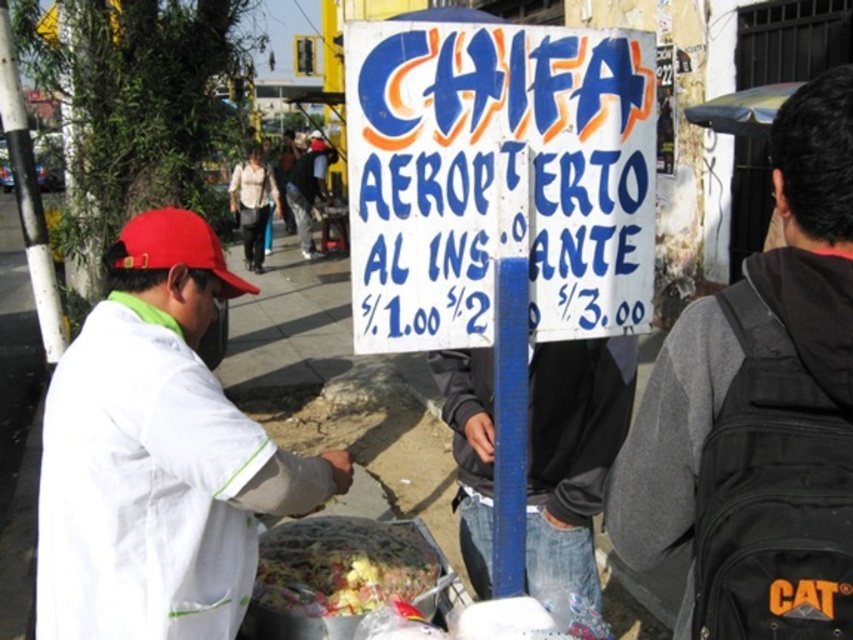
Is white cardboard sign at center wider than shiny plastic container at center?

Correct, the width of white cardboard sign at center exceeds that of shiny plastic container at center.

Where is `white cardboard sign at center`? Image resolution: width=853 pixels, height=640 pixels. white cardboard sign at center is located at coordinates (497, 179).

Is the position of white cardboard sign at center less distant than that of white fabric jacket at left?

No, white cardboard sign at center is further to the viewer.

Does point (381, 352) come farther from viewer compared to point (317, 504)?

That is False.

Does point (614, 221) lie in front of point (51, 618)?

No, it is behind (51, 618).

At what (x,y) coordinates should I click in order to perform the action: click on white cardboard sign at center. Please return your answer as a coordinate pair (x, y). This screenshot has width=853, height=640. Looking at the image, I should click on (497, 179).

Looking at this image, is white cardboard sign at center positioned at the back of matte red cap at left?

No, it is in front of matte red cap at left.

Is white cardboard sign at center wider than matte red cap at left?

Yes, white cardboard sign at center is wider than matte red cap at left.

Where is `white cardboard sign at center`? white cardboard sign at center is located at coordinates (497, 179).

At what (x,y) coordinates should I click in order to perform the action: click on white cardboard sign at center. Please return your answer as a coordinate pair (x, y). The image size is (853, 640). Looking at the image, I should click on (497, 179).